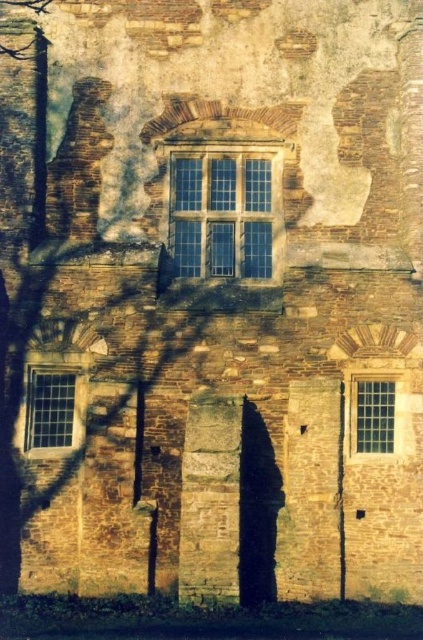
You are standing in front of the old stone building and want to touch both the point at coordinates point (236, 177) and point (54, 445) on the wall. Which point will you reach first?

You will reach the point (236, 177) first because it is closer to you than the point (54, 445), which is further away.

You are standing in front of the old stone building and want to touch the clear glass window at lower left and the clear glass window at lower right. Which window will you reach first as you move forward?

The clear glass window at lower left is closer to you, so you will reach it first before the clear glass window at lower right.